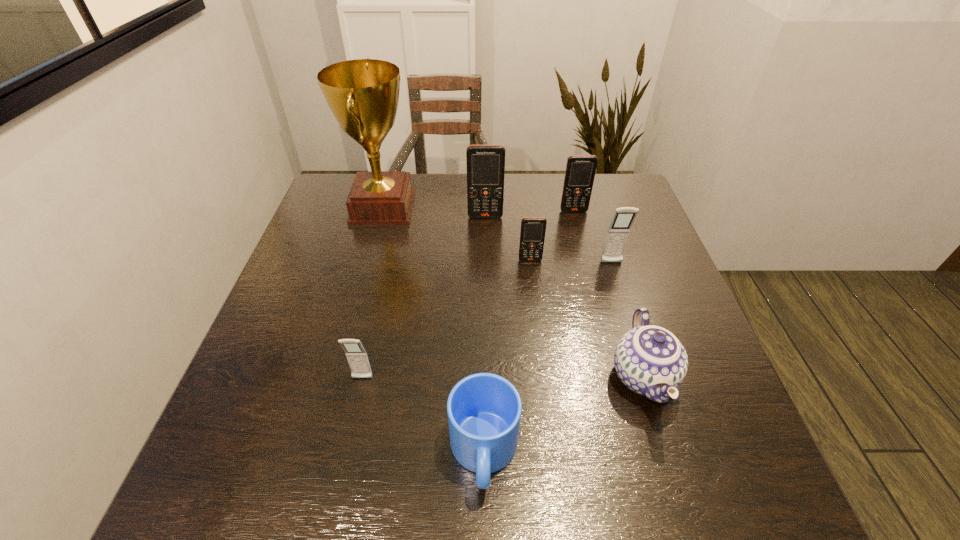
Locate an element on the screen. This screenshot has height=540, width=960. the smaller gray cellular telephone is located at coordinates (356, 355).

I want to click on the leftmost cellular telephone, so coord(356,355).

The width and height of the screenshot is (960, 540). Find the location of `chinaware`. chinaware is located at coordinates (650, 360).

At what (x,y) coordinates should I click in order to perform the action: click on mug. Please return your answer as a coordinate pair (x, y). The image size is (960, 540). Looking at the image, I should click on (484, 410).

Identify the location of vacant space located 0.260m on the plaque of the gold award. (503, 207).

Where is `vacant position located on the screen of the second nearest orange cellular telephone`? This screenshot has height=540, width=960. vacant position located on the screen of the second nearest orange cellular telephone is located at coordinates (487, 295).

Where is `free spot located 0.240m on the front-facing side of the right gray cellular telephone`? This screenshot has height=540, width=960. free spot located 0.240m on the front-facing side of the right gray cellular telephone is located at coordinates (636, 341).

Find the location of a particular element. vacant space located on the screen of the farthest orange cellular telephone is located at coordinates (592, 283).

You are a GUI agent. You are given a task and a screenshot of the screen. Output one action in this format:
    pyautogui.click(x=<x>, y=<y>)
    Task: Click on the vacant space situated 0.140m on the screen of the smallest orange cellular telephone
    
    Given the screenshot: What is the action you would take?
    pyautogui.click(x=536, y=302)

Where is `free space located 0.200m on the front-facing side of the leftmost cellular telephone`? The height and width of the screenshot is (540, 960). free space located 0.200m on the front-facing side of the leftmost cellular telephone is located at coordinates (339, 486).